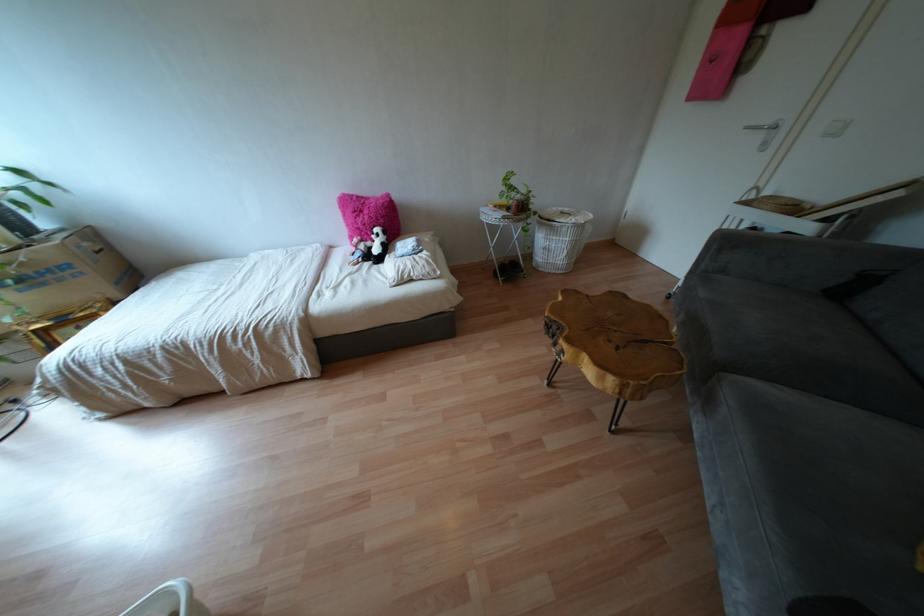
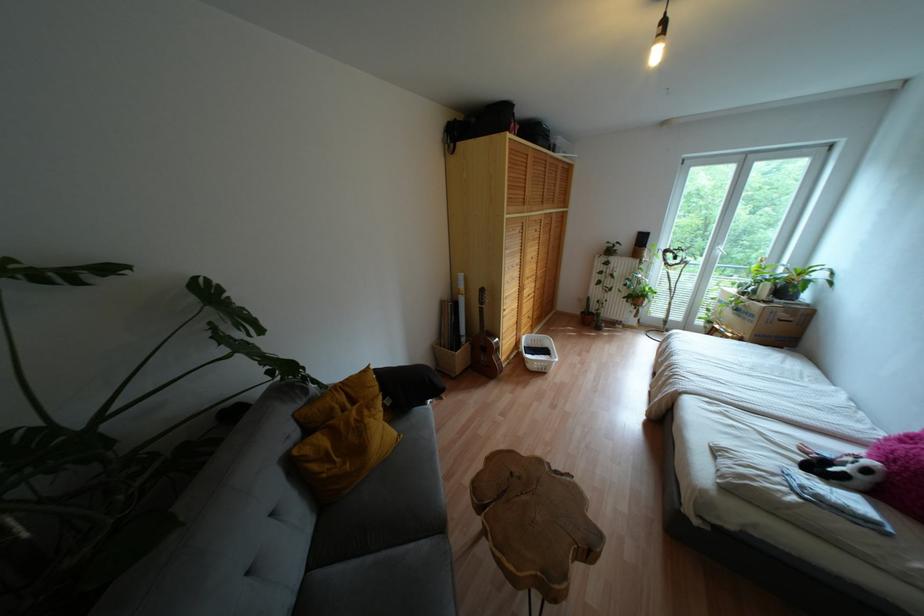
Where in the second image is the point corresponding to [383,232] from the first image?

(867, 471)